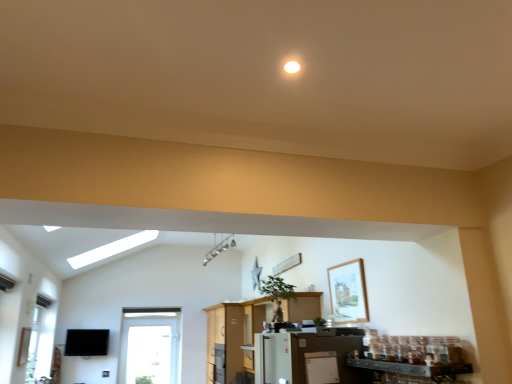
Describe the element at coordinates (234, 334) in the screenshot. The height and width of the screenshot is (384, 512). I see `white glossy refrigerator at center` at that location.

Where is `wooden framed picture at upper right`? wooden framed picture at upper right is located at coordinates (348, 292).

Is white matte refrigerator at lower center behind white glossy refrigerator at center?

No, white matte refrigerator at lower center is closer to the camera.

From a real-world perspective, is white matte refrigerator at lower center physically located above or below white glossy refrigerator at center?

white matte refrigerator at lower center is situated lower than white glossy refrigerator at center in the real world.

Considering the points (318, 359) and (225, 371), which point is in front, point (318, 359) or point (225, 371)?

The point (318, 359) is more forward.

The image size is (512, 384). What are the coordinates of `entertainment center below the white matte refrigerator at lower center (from the image's perspective)` in the screenshot? It's located at (234, 334).

From a real-world perspective, is white glossy refrigerator at center located beneath white matte refrigerator at lower center?

Incorrect, from a real-world perspective, white glossy refrigerator at center is higher than white matte refrigerator at lower center.

Is white glossy refrigerator at center at the right side of white matte refrigerator at lower center?

No.

Does white glossy refrigerator at center have a greater height compared to white matte refrigerator at lower center?

Yes, white glossy refrigerator at center is taller than white matte refrigerator at lower center.

Find the location of a particular element. This screenshot has height=384, width=512. window behind the white matte refrigerator at lower center is located at coordinates (149, 346).

Based on the photo, from the image's perspective, between white matte refrigerator at lower center and transparent glass window at lower left, which one is located above?

white matte refrigerator at lower center.

Is white matte refrigerator at lower center spatially inside transparent glass window at lower left, or outside of it?

white matte refrigerator at lower center is spatially situated outside transparent glass window at lower left.

Looking at this image, is white matte refrigerator at lower center facing away from transparent glass window at lower left?

Yes, white matte refrigerator at lower center is positioned with its back facing transparent glass window at lower left.

Is wooden framed picture at upper right at the back of white matte refrigerator at lower center?

No.

Which object is positioned more to the right, white matte refrigerator at lower center or wooden framed picture at upper right?

Positioned to the right is wooden framed picture at upper right.

Is wooden framed picture at upper right inside white matte refrigerator at lower center?

No, white matte refrigerator at lower center does not contain wooden framed picture at upper right.

Is white matte refrigerator at lower center bigger or smaller than wooden framed picture at upper right?

Considering their sizes, white matte refrigerator at lower center takes up less space than wooden framed picture at upper right.

Is there a large distance between white glossy refrigerator at center and transparent glass window at lower left?

white glossy refrigerator at center is actually quite close to transparent glass window at lower left.

At what (x,y) coordinates should I click in order to perform the action: click on entertainment center above the transparent glass window at lower left (from a real-world perspective). Please return your answer as a coordinate pair (x, y). Looking at the image, I should click on (234, 334).

In terms of width, does white glossy refrigerator at center look wider or thinner when compared to transparent glass window at lower left?

In the image, white glossy refrigerator at center appears to be wider than transparent glass window at lower left.

Does white glossy refrigerator at center contain transparent glass window at lower left?

Actually, transparent glass window at lower left is outside white glossy refrigerator at center.

Does point (161, 361) come farther from viewer compared to point (210, 314)?

Yes, it is behind point (210, 314).

From the image's perspective, is transparent glass window at lower left below white glossy refrigerator at center?

Indeed, from the image's perspective, transparent glass window at lower left is shown beneath white glossy refrigerator at center.

Consider the image. Could you tell me if transparent glass window at lower left is turned towards white glossy refrigerator at center?

No, transparent glass window at lower left does not turn towards white glossy refrigerator at center.

How many degrees apart are the facing directions of transparent glass window at lower left and white glossy refrigerator at center?

The angle between the facing direction of transparent glass window at lower left and the facing direction of white glossy refrigerator at center is 88 degrees.

From the image's perspective, which is above, wooden framed picture at upper right or white glossy refrigerator at center?

wooden framed picture at upper right is shown above in the image.

Is wooden framed picture at upper right inside the boundaries of white glossy refrigerator at center, or outside?

wooden framed picture at upper right is not enclosed by white glossy refrigerator at center.

From their relative heights in the image, would you say wooden framed picture at upper right is taller or shorter than white glossy refrigerator at center?

In the image, wooden framed picture at upper right appears to be shorter than white glossy refrigerator at center.

Is point (349, 304) closer to camera compared to point (228, 359)?

Yes, it is in front of point (228, 359).

Where is `appliance in front of the white glossy refrigerator at center`? This screenshot has width=512, height=384. appliance in front of the white glossy refrigerator at center is located at coordinates (321, 367).

You are a GUI agent. You are given a task and a screenshot of the screen. Output one action in this format:
    pyautogui.click(x=<x>, y=<y>)
    Task: Click on the appliance on the right of white glossy refrigerator at center
    The image size is (512, 384).
    Given the screenshot: What is the action you would take?
    pyautogui.click(x=321, y=367)

Considering their positions, is wooden framed picture at upper right positioned closer to white matte refrigerator at lower center than white glossy refrigerator at center?

Among the two, wooden framed picture at upper right is located nearer to white matte refrigerator at lower center.

Looking at the image, which one is located further to wooden framed picture at upper right, white glossy refrigerator at center or transparent glass window at lower left?

transparent glass window at lower left is further to wooden framed picture at upper right.

Based on the photo, from the image, which object appears to be nearer to wooden framed picture at upper right, transparent glass window at lower left or white glossy refrigerator at center?

white glossy refrigerator at center is positioned closer to the anchor wooden framed picture at upper right.

When comparing their distances from wooden framed picture at upper right, does white glossy refrigerator at center or white matte refrigerator at lower center seem closer?

Among the two, white matte refrigerator at lower center is located nearer to wooden framed picture at upper right.

Estimate the real-world distances between objects in this image. Which object is further from white glossy refrigerator at center, wooden framed picture at upper right or transparent glass window at lower left?

wooden framed picture at upper right is positioned further to the anchor white glossy refrigerator at center.

Considering their positions, is wooden framed picture at upper right positioned closer to transparent glass window at lower left than white glossy refrigerator at center?

Among the two, white glossy refrigerator at center is located nearer to transparent glass window at lower left.

Estimate the real-world distances between objects in this image. Which object is closer to white glossy refrigerator at center, transparent glass window at lower left or wooden framed picture at upper right?

The object closer to white glossy refrigerator at center is transparent glass window at lower left.

Which object lies further to the anchor point white matte refrigerator at lower center, white glossy refrigerator at center or wooden framed picture at upper right?

white glossy refrigerator at center.

The height and width of the screenshot is (384, 512). I want to click on picture frame positioned between white matte refrigerator at lower center and white glossy refrigerator at center from near to far, so click(348, 292).

Find the location of `entertainment center between white matte refrigerator at lower center and transparent glass window at lower left in the front-back direction`. entertainment center between white matte refrigerator at lower center and transparent glass window at lower left in the front-back direction is located at coordinates (234, 334).

Where is `picture frame between white matte refrigerator at lower center and transparent glass window at lower left along the z-axis`? picture frame between white matte refrigerator at lower center and transparent glass window at lower left along the z-axis is located at coordinates (348, 292).

Where is `entertainment center between wooden framed picture at upper right and transparent glass window at lower left from front to back`? Image resolution: width=512 pixels, height=384 pixels. entertainment center between wooden framed picture at upper right and transparent glass window at lower left from front to back is located at coordinates (234, 334).